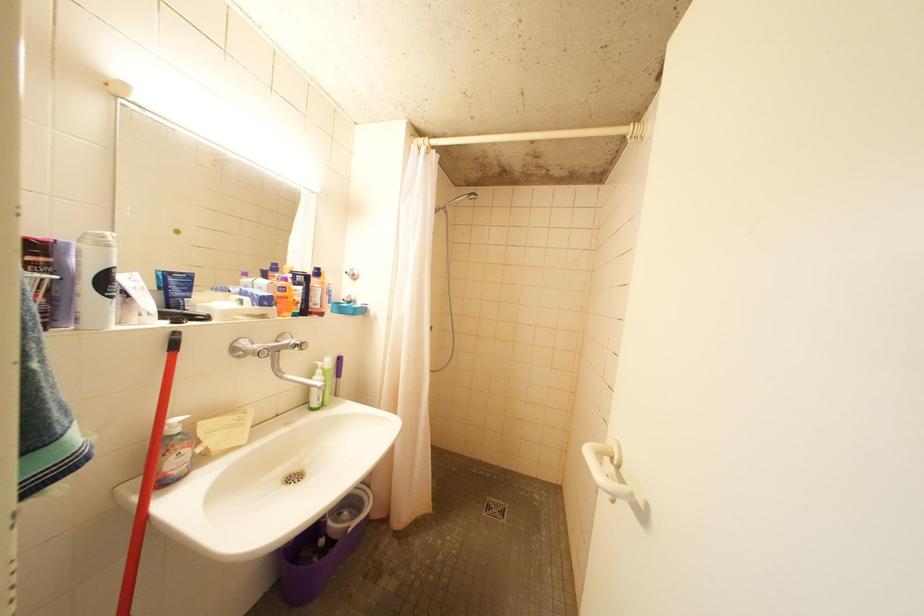
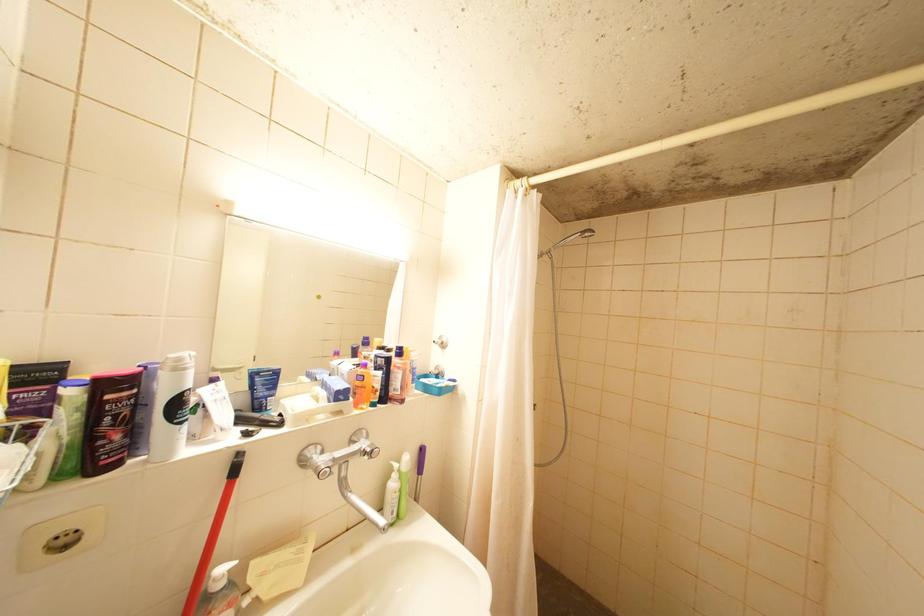
Question: The images are taken continuously from a first-person perspective. In which direction are you moving?

Choices:
 (A) Left
 (B) Right
 (C) Forward
 (D) Backward

Answer: (C)